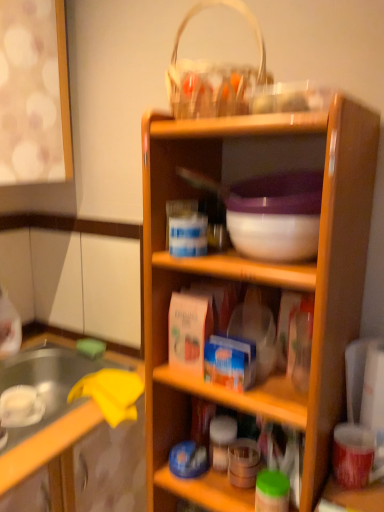
Question: Is wooden shelf at center to the right of white woven basket at upper center from the viewer's perspective?

Choices:
 (A) no
 (B) yes

Answer: (B)

Question: From the image's perspective, is wooden shelf at center above white woven basket at upper center?

Choices:
 (A) yes
 (B) no

Answer: (B)

Question: Is wooden shelf at center not close to white woven basket at upper center?

Choices:
 (A) no
 (B) yes

Answer: (A)

Question: Considering the relative sizes of wooden shelf at center and white woven basket at upper center in the image provided, is wooden shelf at center bigger than white woven basket at upper center?

Choices:
 (A) yes
 (B) no

Answer: (A)

Question: Is wooden shelf at center facing towards white woven basket at upper center?

Choices:
 (A) yes
 (B) no

Answer: (B)

Question: Looking at the image, does wooden shelf at center seem bigger or smaller compared to white woven basket at upper center?

Choices:
 (A) small
 (B) big

Answer: (B)

Question: From their relative heights in the image, would you say wooden shelf at center is taller or shorter than white woven basket at upper center?

Choices:
 (A) tall
 (B) short

Answer: (A)

Question: Considering the relative positions of wooden shelf at center and white woven basket at upper center in the image provided, is wooden shelf at center to the left or to the right of white woven basket at upper center?

Choices:
 (A) left
 (B) right

Answer: (B)

Question: From the image's perspective, is wooden shelf at center positioned above or below white woven basket at upper center?

Choices:
 (A) below
 (B) above

Answer: (A)

Question: Is point (162, 247) closer or farther from the camera than point (130, 486)?

Choices:
 (A) closer
 (B) farther

Answer: (A)

Question: Based on their sizes in the image, would you say wooden shelf at center is bigger or smaller than wooden cabinet at center?

Choices:
 (A) big
 (B) small

Answer: (B)

Question: Is wooden shelf at center spatially inside wooden cabinet at center, or outside of it?

Choices:
 (A) outside
 (B) inside

Answer: (A)

Question: In terms of height, does wooden shelf at center look taller or shorter compared to wooden cabinet at center?

Choices:
 (A) tall
 (B) short

Answer: (A)

Question: Is white woven basket at upper center taller or shorter than wooden cabinet at center?

Choices:
 (A) short
 (B) tall

Answer: (A)

Question: Does point (175, 66) appear closer or farther from the camera than point (139, 430)?

Choices:
 (A) farther
 (B) closer

Answer: (B)